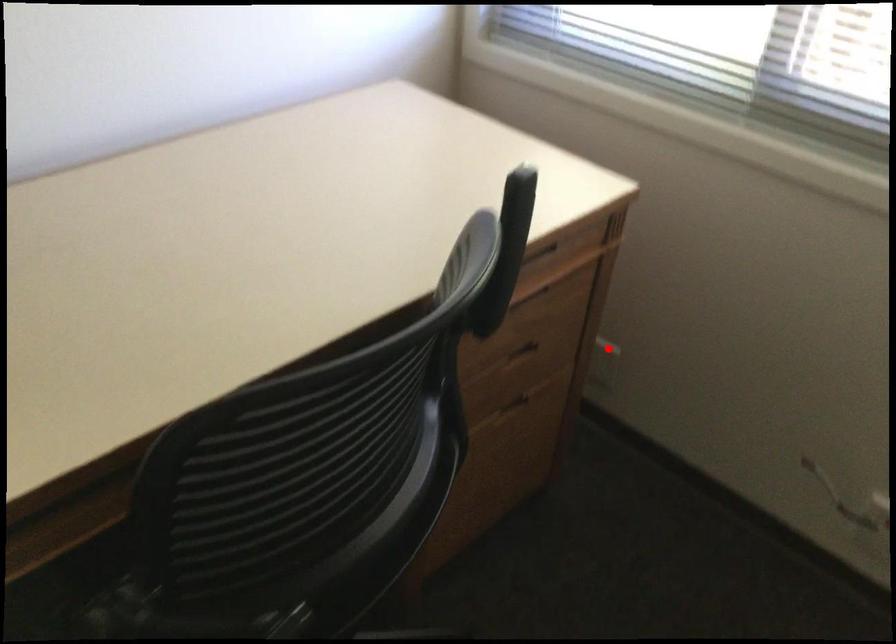
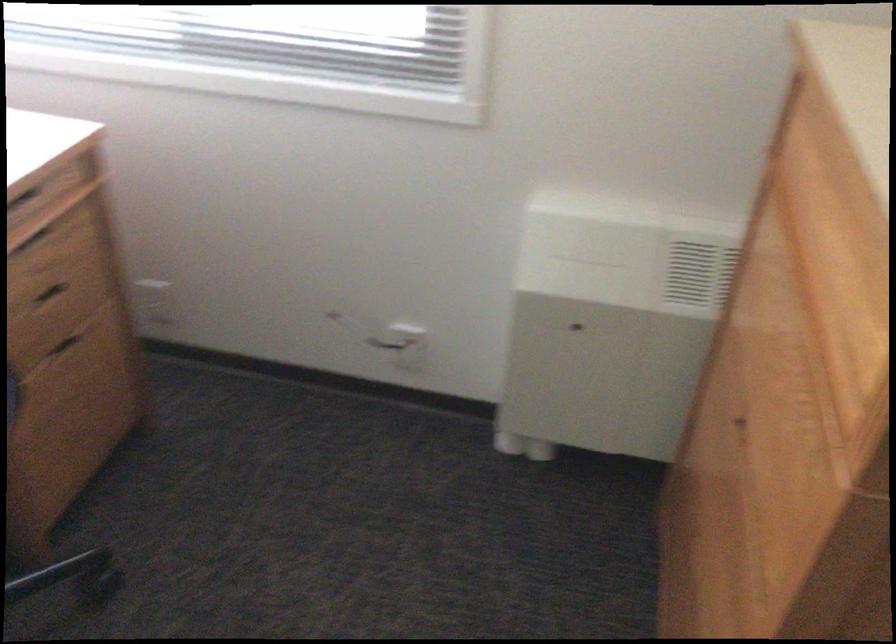
Question: I am providing you with two images of the same scene from different viewpoints. Image1 has a red point marked. In image2, the corresponding 3D location appears at what relative position? Reply with the corresponding letter.

Choices:
 (A) Closer
 (B) Farther

Answer: (B)